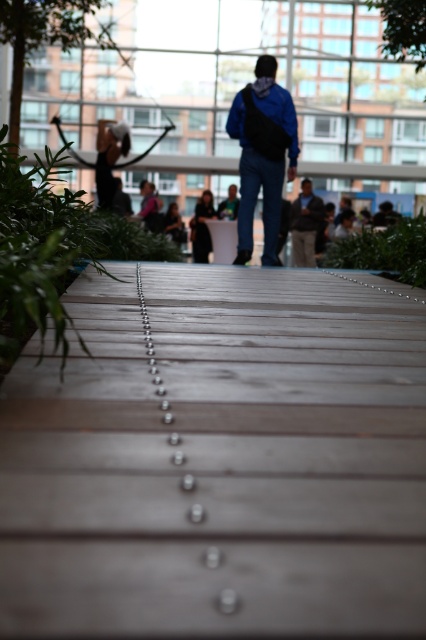
Question: Estimate the real-world distances between objects in this image. Which object is closer to the wooden planks at center?

Choices:
 (A) green leafy plant at left
 (B) green leafy plant at center
 (C) dark gray fabric jacket at center
 (D) blue denim jeans at center

Answer: (A)

Question: Is blue denim jacket at center smaller than dark gray fabric jacket at center?

Choices:
 (A) yes
 (B) no

Answer: (A)

Question: Estimate the real-world distances between objects in this image. Which object is closer to the green leafy plant at center?

Choices:
 (A) wooden planks at center
 (B) dark gray fabric jacket at center

Answer: (A)

Question: Which of the following is the closest to the observer?

Choices:
 (A) (253, 172)
 (B) (226, 200)
 (C) (406, 234)
 (D) (256, 484)

Answer: (D)

Question: Can you confirm if wooden planks at center is positioned to the left of green leafy plant at left?

Choices:
 (A) yes
 (B) no

Answer: (B)

Question: Does wooden planks at center appear on the left side of blue denim jeans at center?

Choices:
 (A) no
 (B) yes

Answer: (B)